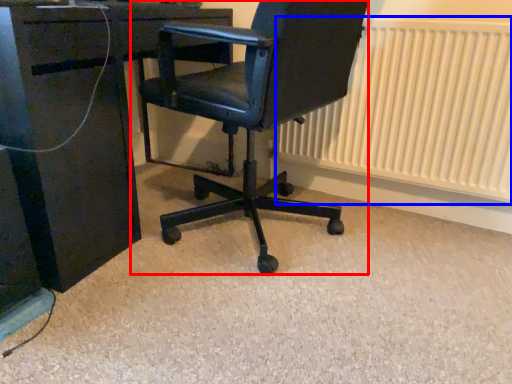
Question: Which of the following is the farthest to the observer, chair (highlighted by a red box) or radiator (highlighted by a blue box)?

Choices:
 (A) chair
 (B) radiator

Answer: (B)